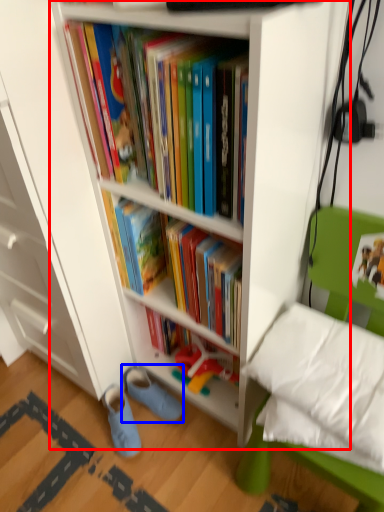
Question: Which object appears closest to the camera in this image, bookcase (highlighted by a red box) or footwear (highlighted by a blue box)?

Choices:
 (A) bookcase
 (B) footwear

Answer: (A)